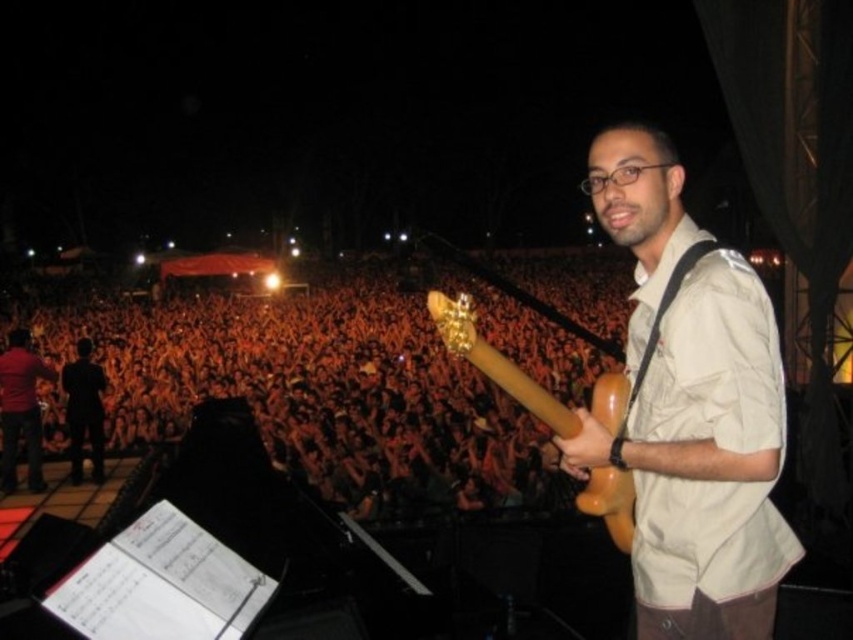
You are a photographer at the concert. You want to take a photo of the matte brown guitar at center without the dark orange fabric crowd at left being visible in the shot. Is this possible based on their positions?

The dark orange fabric crowd at left is positioned under the matte brown guitar at center, so if you aim your camera directly at the matte brown guitar at center, the crowd below it would not be visible in the frame.

You are a photographer at the concert and want to focus on the performer on stage. You notice two points in your camera viewfinder labeled as point 1 and point 2. Point 1 is located at coordinates point (561, 289) and point 2 is at point (22, 385). Which point should you focus on to ensure the performer is sharp?

You should focus on point 1 at point (561, 289) because it is closer to the camera than point 2 at point (22, 385), making it the better choice for capturing the performer clearly.

From the picture: You are a photographer at the concert and want to capture both the woodenwoodenguitar at right and the red shirt at left in your shot. Which object should you focus on first to ensure both are in focus?

You should focus on the woodenwoodenguitar at right first since it is closer to the viewer than the red shirt at left, ensuring both will be in focus when using a shallow depth of field.